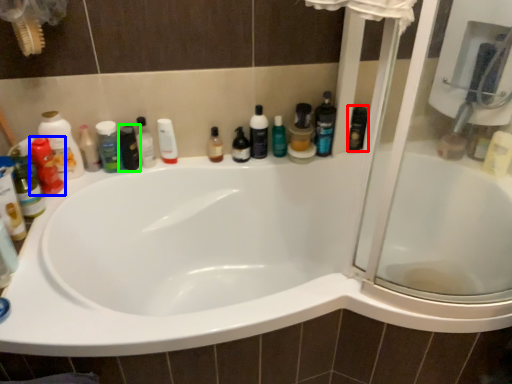
Question: Which object is the farthest from toiletry (highlighted by a red box)? Choose among these: toiletry (highlighted by a blue box) or mouthwash (highlighted by a green box).

Choices:
 (A) toiletry
 (B) mouthwash

Answer: (A)